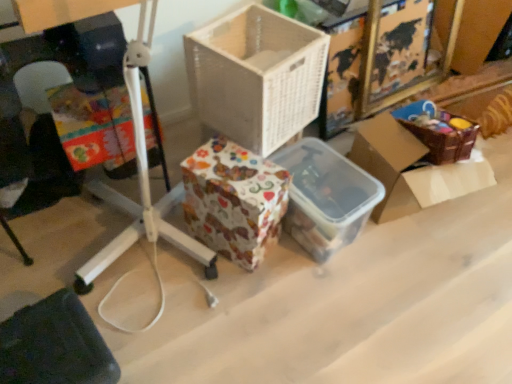
In order to click on vacant area that is in front of brown woven basket at upper right, positioned as the first box in right-to-left order in this screenshot , I will do [426, 285].